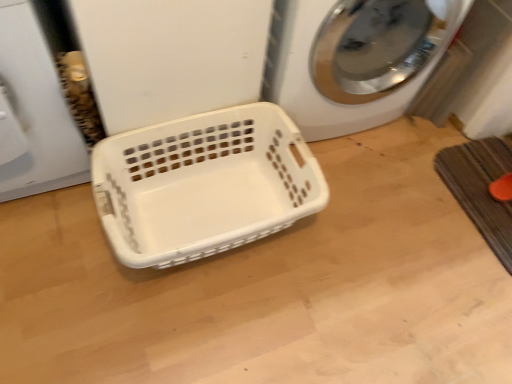
Locate an element on the screen. This screenshot has width=512, height=384. unoccupied region to the right of white plastic basket at center is located at coordinates (370, 251).